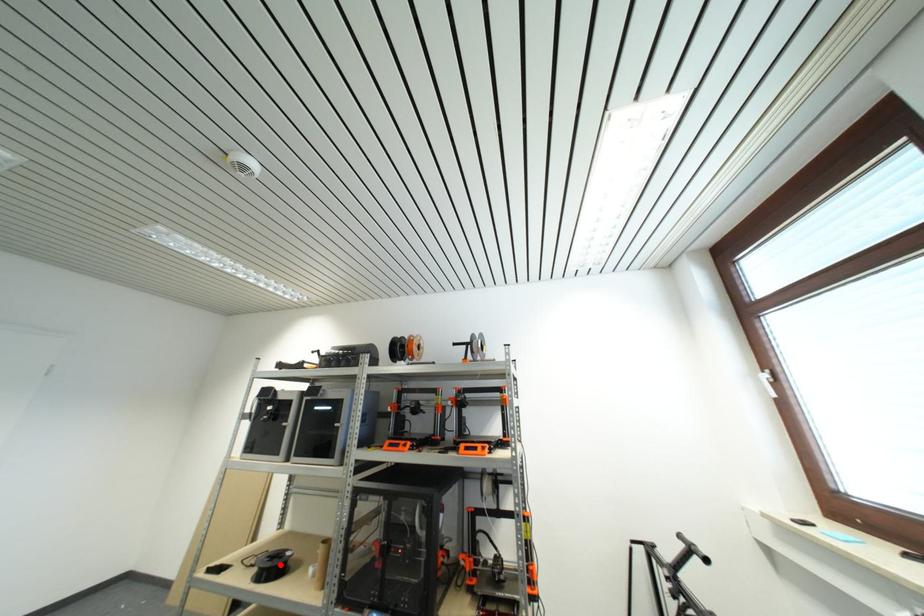
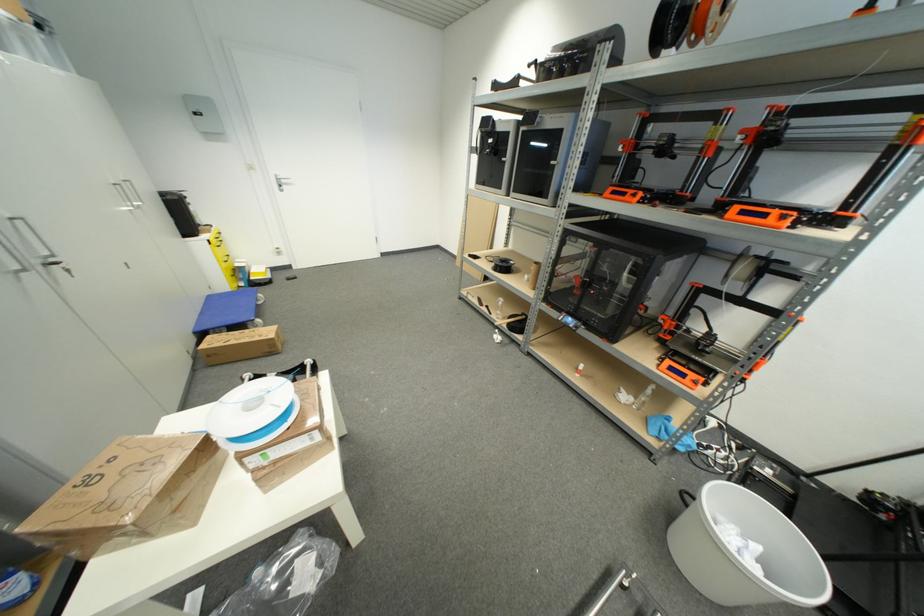
Locate, in the second image, the point that corresponds to the highlighted location in the first image.

(508, 267)